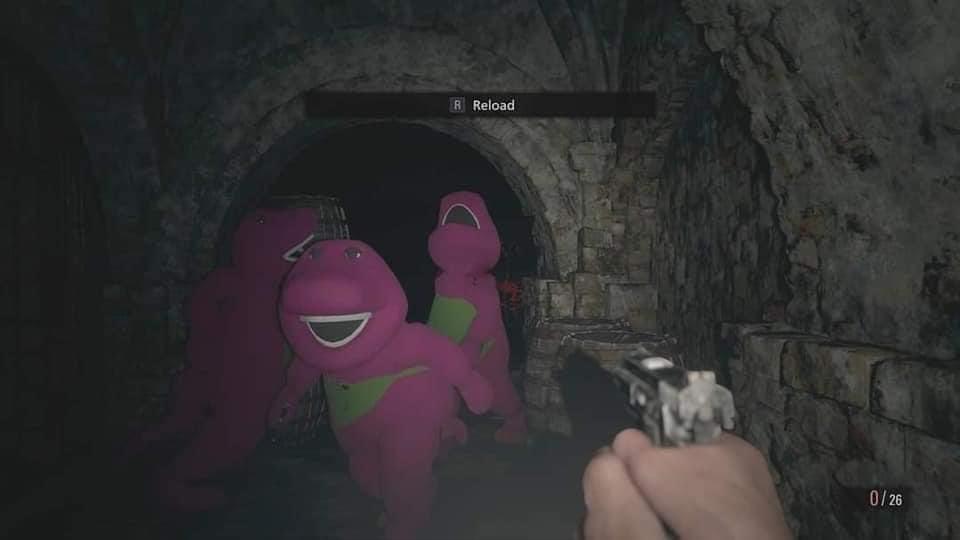
At what (x,y) coordinates should I click in order to perform the action: click on archway. Please return your answer as a coordinate pair (x, y). The height and width of the screenshot is (540, 960). Looking at the image, I should click on (276, 147).